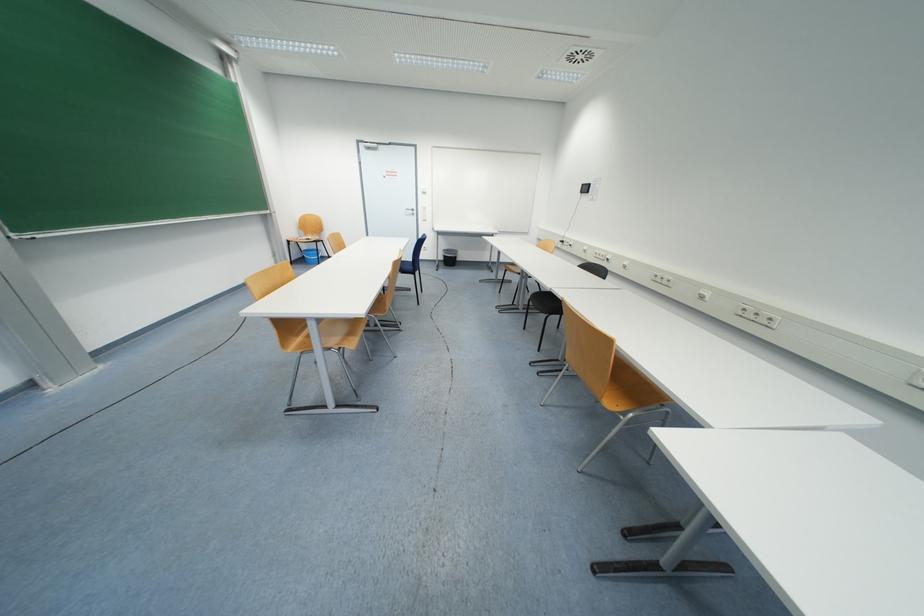
Where is `blue chair sitting surface`? The image size is (924, 616). blue chair sitting surface is located at coordinates (406, 267).